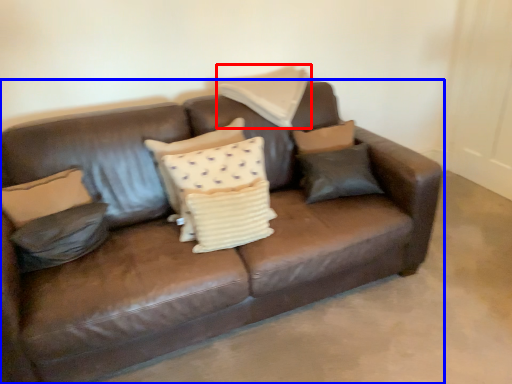
Question: Among these objects, which one is farthest to the camera, pillow (highlighted by a red box) or studio couch (highlighted by a blue box)?

Choices:
 (A) pillow
 (B) studio couch

Answer: (A)